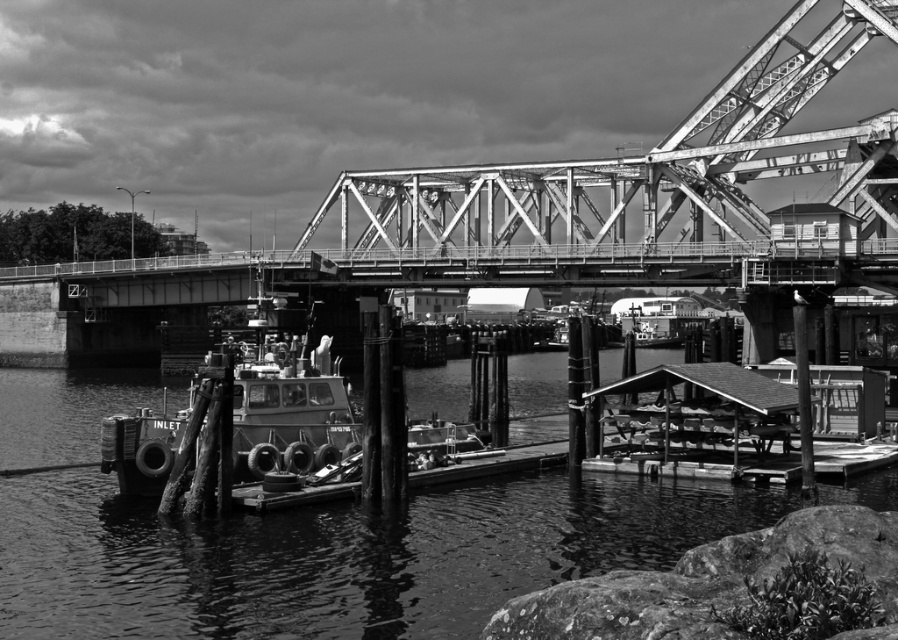
Identify the location of smooth water at dock center. (336, 556).

Is smooth water at dock center bigger than metallic boat at center?

Indeed, smooth water at dock center has a larger size compared to metallic boat at center.

What do you see at coordinates (336, 556) in the screenshot? The width and height of the screenshot is (898, 640). I see `smooth water at dock center` at bounding box center [336, 556].

At what (x,y) coordinates should I click in order to perform the action: click on smooth water at dock center. Please return your answer as a coordinate pair (x, y). Looking at the image, I should click on (336, 556).